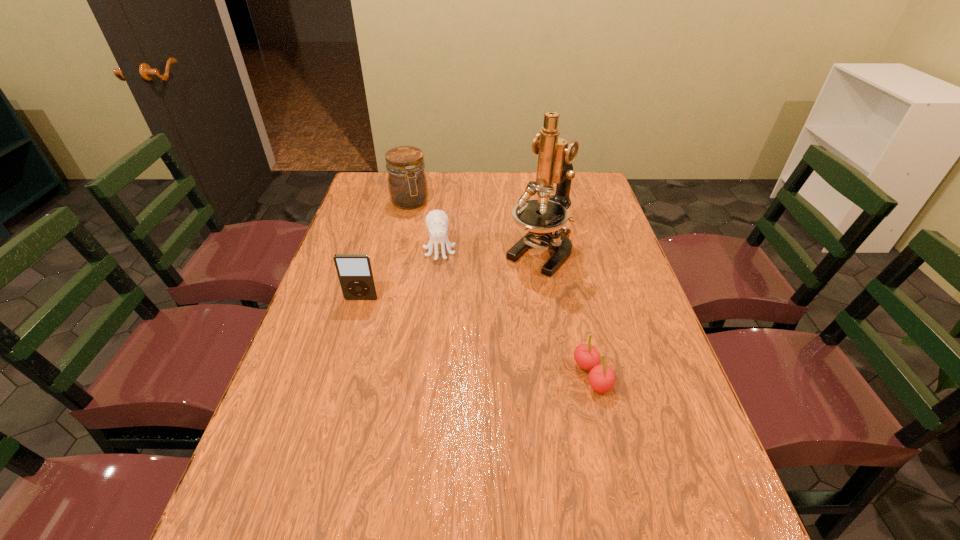
The height and width of the screenshot is (540, 960). What are the coordinates of `vacant space on the desktop that is between the third tallest object and the shortest object and is positioned on the lid of the fourth shortest object` in the screenshot? It's located at (x=479, y=338).

Find the location of a particular element. This screenshot has height=540, width=960. free spot on the desktop that is between the fourth farthest object and the cherry and is positioned at the eyepiece of the microscope is located at coordinates (460, 332).

Where is `free space on the desktop that is between the third shortest object and the cherry and is positioned on the front-facing side of the third object from right to left`? The image size is (960, 540). free space on the desktop that is between the third shortest object and the cherry and is positioned on the front-facing side of the third object from right to left is located at coordinates (448, 328).